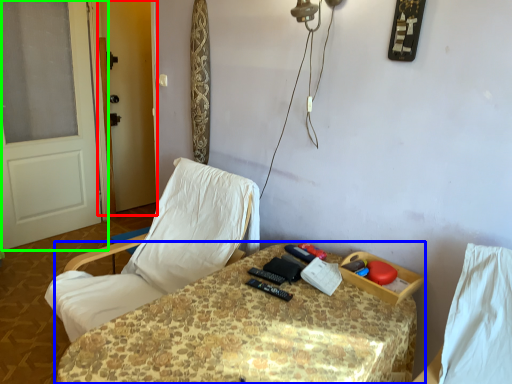
Question: Which object is the closest to the screen door (highlighted by a red box)? Choose among these: table (highlighted by a blue box) or door (highlighted by a green box).

Choices:
 (A) table
 (B) door

Answer: (B)